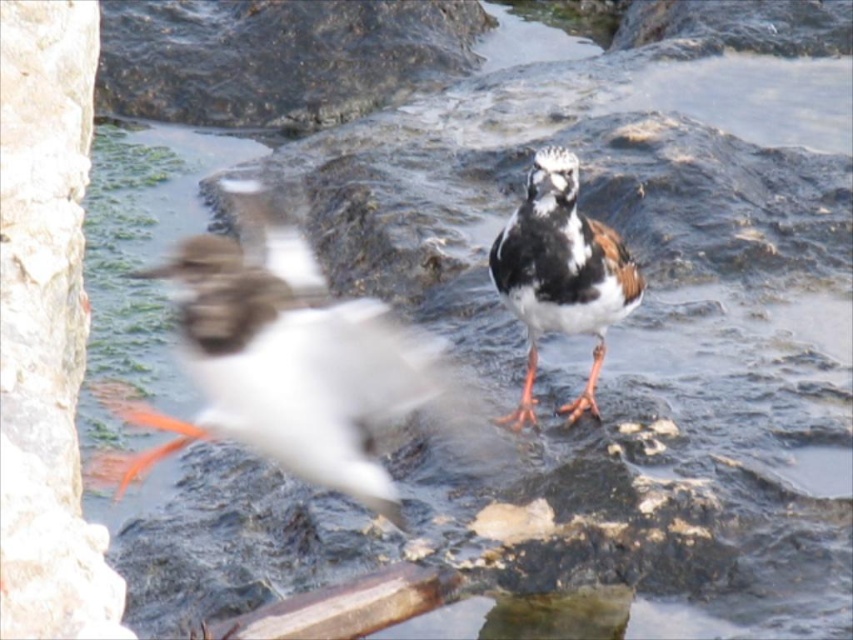
Question: Which point is closer to the camera?

Choices:
 (A) white glossy bird at center
 (B) stone at left
 (C) speckled feathered bird at center

Answer: (B)

Question: Does stone at left have a smaller size compared to speckled feathered bird at center?

Choices:
 (A) yes
 (B) no

Answer: (B)

Question: Considering the real-world distances, which object is farthest from the speckled feathered bird at center?

Choices:
 (A) white glossy bird at center
 (B) stone at left

Answer: (B)

Question: Which point is farther from the camera taking this photo?

Choices:
 (A) (410, 332)
 (B) (10, 348)

Answer: (A)

Question: Is white glossy bird at center above speckled feathered bird at center?

Choices:
 (A) no
 (B) yes

Answer: (A)

Question: Is stone at left below speckled feathered bird at center?

Choices:
 (A) no
 (B) yes

Answer: (B)